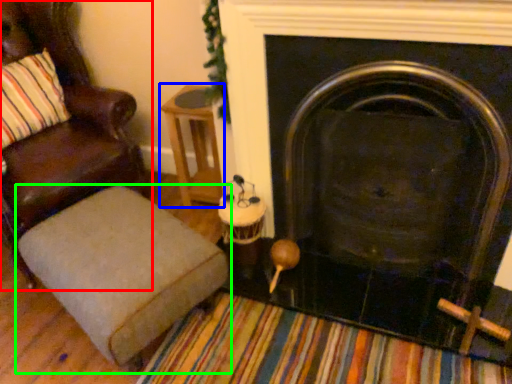
Question: Based on their relative distances, which object is farther from chair (highlighted by a red box)? Choose from side table (highlighted by a blue box) and furniture (highlighted by a green box).

Choices:
 (A) side table
 (B) furniture

Answer: (B)